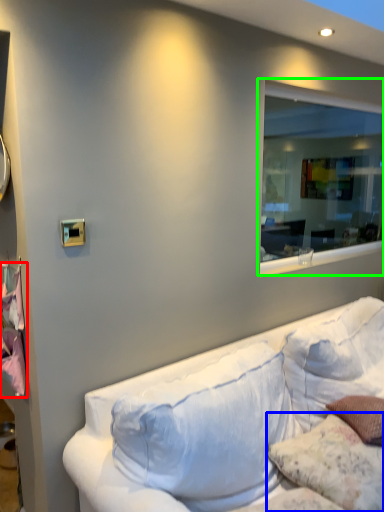
Question: Which object is the farthest from sheet (highlighted by a red box)? Choose among these: pillow (highlighted by a blue box) or window (highlighted by a green box).

Choices:
 (A) pillow
 (B) window

Answer: (B)